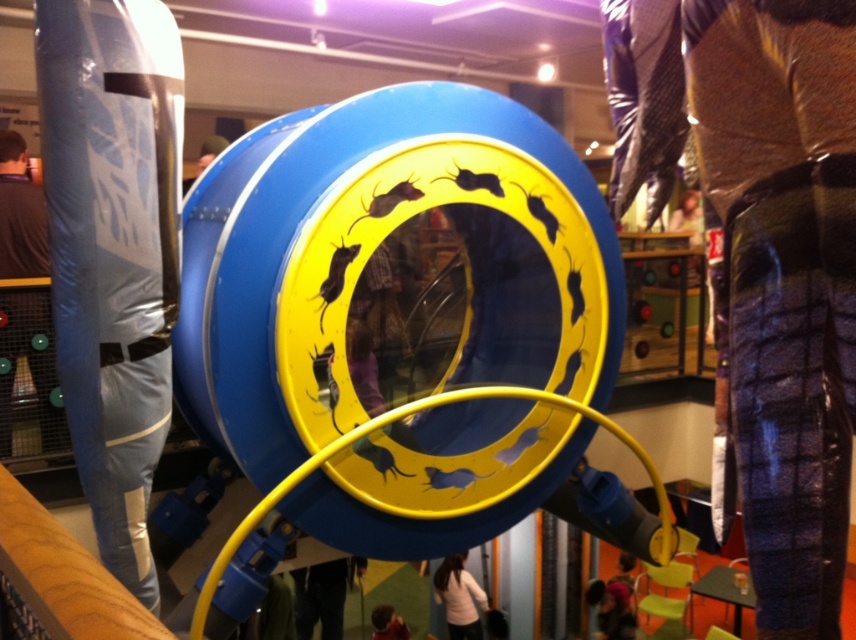
Question: Does white sweater at center have a greater width compared to smooth brown hair at center?

Choices:
 (A) no
 (B) yes

Answer: (B)

Question: Does plaid fabric pants at right have a larger size compared to smooth brown hair at center?

Choices:
 (A) yes
 (B) no

Answer: (A)

Question: Which point is farther from the camera taking this photo?

Choices:
 (A) (391, 618)
 (B) (450, 584)
 (C) (623, 109)
 (D) (15, 412)

Answer: (A)

Question: Which of the following is the closest to the observer?

Choices:
 (A) (837, 38)
 (B) (27, 353)
 (C) (461, 634)

Answer: (A)

Question: Which of the following is the farthest from the observer?

Choices:
 (A) white sweater at center
 (B) plaid fabric pants at right
 (C) denim pants at lower center
 (D) smooth brown hair at center

Answer: (A)

Question: Is plaid fabric pants at right smaller than brown fuzzy sweater at left?

Choices:
 (A) no
 (B) yes

Answer: (A)